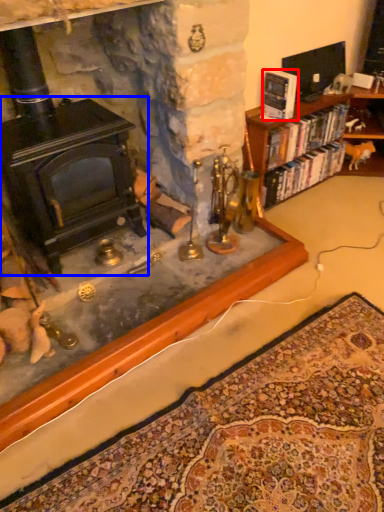
Question: Which of the following is the farthest to the observer, book (highlighted by a red box) or fireplace (highlighted by a blue box)?

Choices:
 (A) book
 (B) fireplace

Answer: (A)